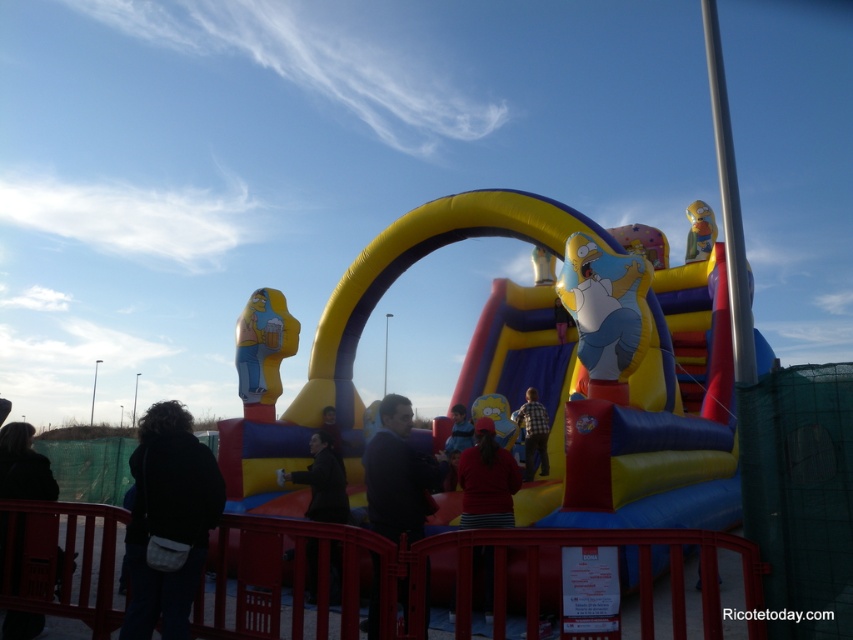
In the scene shown: You are standing in the middle of the bouncy castle and want to find the matte red shirt at center. Which direction should you look to see it?

The matte red shirt at center is located at coordinates point (486, 481), so you should look towards the right side of the bouncy castle to find it.

You are a photographer positioned at the front of the bouncy castle. You want to take a photo that includes both the black fabric jacket at lower left and the matte red shirt at center. Which of the two items will appear larger in the photo?

The black fabric jacket at lower left appears larger in the photo because it is closer to the viewer than the matte red shirt at center.

You are standing at the entrance of the bouncy castle and want to locate the person wearing a checkered fabric shirt at center. According to the coordinates provided, in which direction should you look relative to your current position?

The checkered fabric shirt at center is located at coordinates point (532, 433), which would be to the upper right direction from your current position at the entrance.